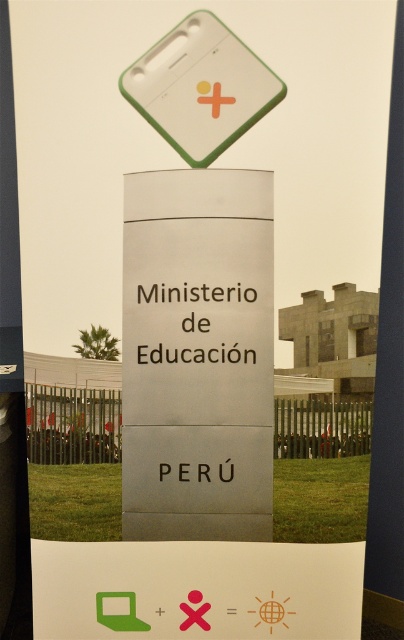
You are standing in front of the signpost for the Ministry of Education in Peru. You see a white plastic sign at upper center and a white smooth pole at right. Which object is positioned higher?

The white plastic sign at upper center is located above the white smooth pole at right, so it is positioned higher.

You are a visitor approaching the signpost and want to read the text on the white plastic sign at upper center. Since the white smooth pole at right is in your way, can you easily look over it to read the sign?

The white plastic sign at upper center has a lesser height compared to white smooth pole at right, so the pole is taller than the sign. Since the pole is taller, you might not be able to easily look over it to read the white plastic sign at upper center.